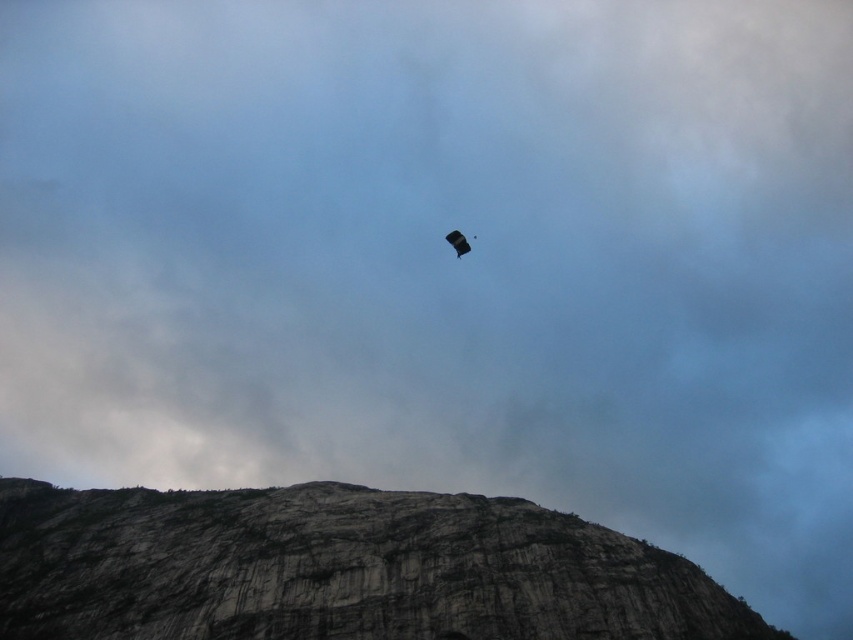
Between gray rock formation at center and matte black parachute at center, which one appears on the right side from the viewer's perspective?

matte black parachute at center

Between point (439, 552) and point (451, 237), which one is positioned behind?

Point (451, 237)

Where is `gray rock formation at center`? The width and height of the screenshot is (853, 640). gray rock formation at center is located at coordinates (338, 568).